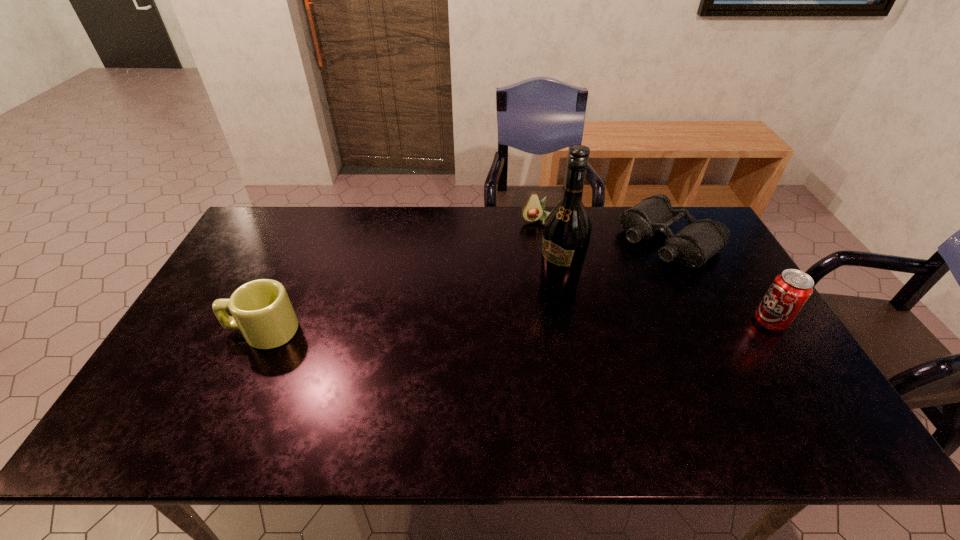
Image resolution: width=960 pixels, height=540 pixels. I want to click on mug, so click(x=261, y=309).

Find the location of `the second tallest object`. the second tallest object is located at coordinates (790, 290).

I want to click on binoculars, so click(700, 240).

This screenshot has width=960, height=540. I want to click on avocado, so click(533, 210).

This screenshot has width=960, height=540. I want to click on wine bottle, so click(x=567, y=229).

Locate an element on the screen. vacant space situated 0.090m with the handle on the side of the leftmost object is located at coordinates (195, 331).

At what (x,y) coordinates should I click in order to perform the action: click on free space located with the handle on the side of the leftmost object. Please return your answer as a coordinate pair (x, y). The width and height of the screenshot is (960, 540). Looking at the image, I should click on (198, 331).

At what (x,y) coordinates should I click in order to perform the action: click on vacant position located on the back of the second tallest object. Please return your answer as a coordinate pair (x, y). Looking at the image, I should click on (715, 235).

You are a GUI agent. You are given a task and a screenshot of the screen. Output one action in this format:
    pyautogui.click(x=<x>, y=<y>)
    Task: Click on the blank space located through the eyepieces of the binoculars
    The image size is (960, 540).
    Given the screenshot: What is the action you would take?
    pyautogui.click(x=583, y=302)

Where is `vacant space located through the eyepieces of the binoculars`? This screenshot has height=540, width=960. vacant space located through the eyepieces of the binoculars is located at coordinates (617, 278).